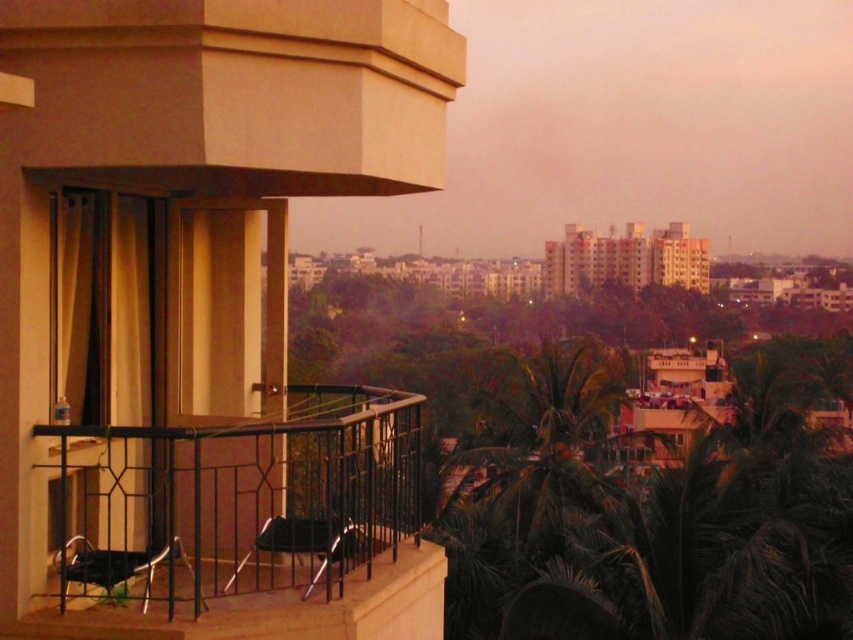
Question: Which of these objects is positioned closest to the black plastic chair at lower left?

Choices:
 (A) metallic black chair at center
 (B) black metal railing at lower left
 (C) matte black balcony at center

Answer: (B)

Question: Which point appears farthest from the camera in this image?

Choices:
 (A) (108, 54)
 (B) (73, 554)

Answer: (B)

Question: Does black plastic chair at lower left have a lesser width compared to metallic black chair at center?

Choices:
 (A) no
 (B) yes

Answer: (B)

Question: Is black plastic chair at lower left to the left of metallic black chair at center from the viewer's perspective?

Choices:
 (A) no
 (B) yes

Answer: (B)

Question: Does matte black balcony at center have a lesser width compared to black metal railing at lower left?

Choices:
 (A) yes
 (B) no

Answer: (B)

Question: Which of the following is the closest to the observer?

Choices:
 (A) matte black balcony at center
 (B) black plastic chair at lower left

Answer: (A)